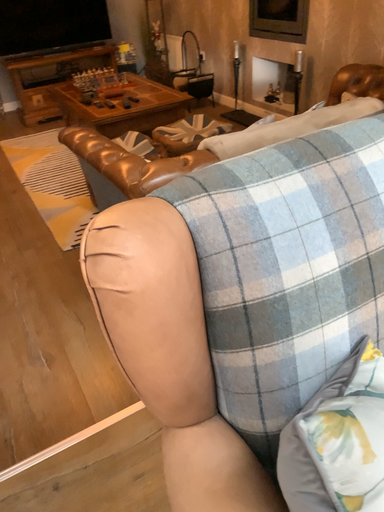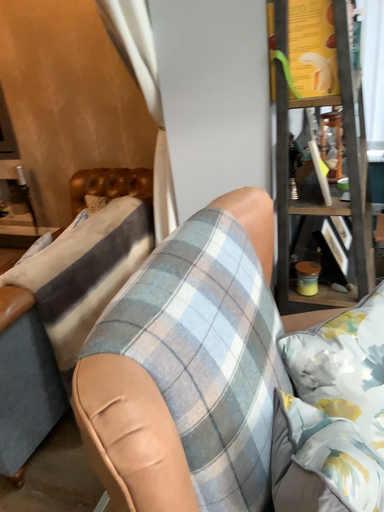
Question: Which way did the camera rotate in the video?

Choices:
 (A) rotated right
 (B) rotated left

Answer: (A)